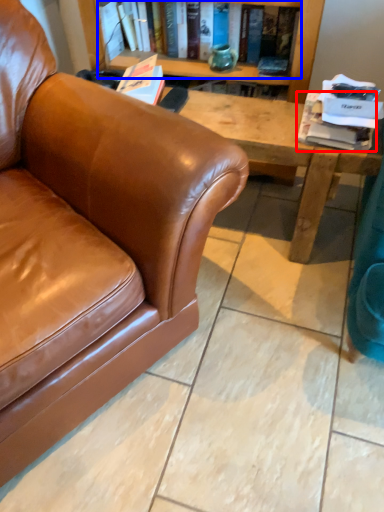
Question: Which of the following is the closest to the observer, book (highlighted by a red box) or book (highlighted by a blue box)?

Choices:
 (A) book
 (B) book

Answer: (A)